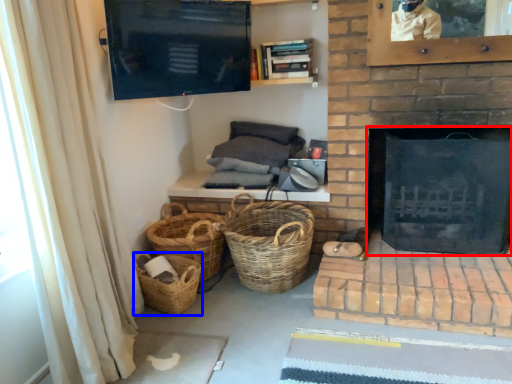
Question: Which point is closer to the camera, fireplace (highlighted by a red box) or basket (highlighted by a blue box)?

Choices:
 (A) fireplace
 (B) basket

Answer: (A)